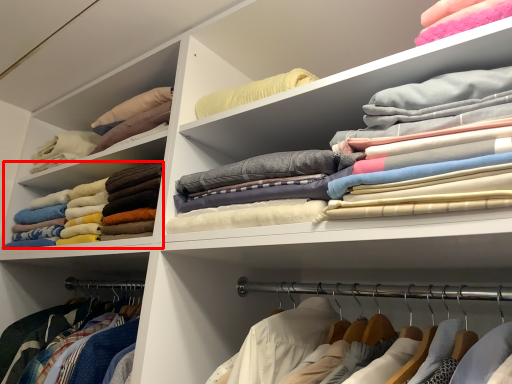
Question: Where is clothing (annotated by the red box) located in relation to clothing in the image?

Choices:
 (A) left
 (B) right

Answer: (A)